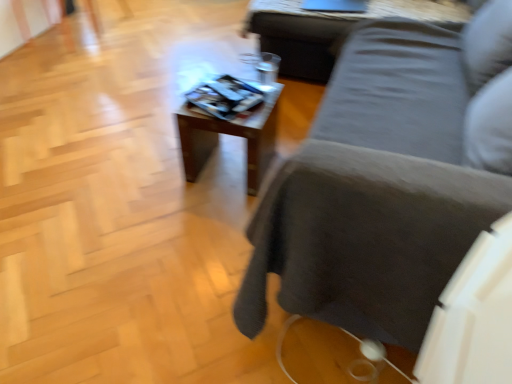
What are the coordinates of `wooden table at center, which ranks as the 1th table in left-to-right order` in the screenshot? It's located at (233, 135).

Who is taller, dark gray fabric couch at center or wooden table at upper center, which is the first table in right-to-left order?

Standing taller between the two is dark gray fabric couch at center.

Considering the relative positions of dark gray fabric couch at center and wooden table at upper center, the 2th table in the left-to-right sequence, in the image provided, is dark gray fabric couch at center to the right of wooden table at upper center, the 2th table in the left-to-right sequence, from the viewer's perspective?

Yes.

From a real-world perspective, count 1st tables downward from the dark gray fabric couch at center and point to it. Please provide its 2D coordinates.

[(330, 30)]

Which object is more forward, dark gray fabric couch at center or wooden table at upper center, which is the first table in right-to-left order?

dark gray fabric couch at center is more forward.

Is dark gray fabric couch at center oriented away from wooden table at center, placed as the first table when sorted from bottom to top?

No.

Looking at their sizes, would you say dark gray fabric couch at center is wider or thinner than wooden table at center, arranged as the first table when viewed from the front?

Clearly, dark gray fabric couch at center has more width compared to wooden table at center, arranged as the first table when viewed from the front.

Image resolution: width=512 pixels, height=384 pixels. Identify the location of the 1st table above the dark gray fabric couch at center (from the image's perspective). (233, 135).

Considering the positions of objects dark gray fabric couch at center and wooden table at center, arranged as the first table when viewed from the front, in the image provided, who is in front, dark gray fabric couch at center or wooden table at center, arranged as the first table when viewed from the front,?

Positioned in front is dark gray fabric couch at center.

Does wooden table at center, which ranks as the 1th table in left-to-right order, have a lesser height compared to wooden table at upper center, which is the 1th table from back to front?

In fact, wooden table at center, which ranks as the 1th table in left-to-right order, may be taller than wooden table at upper center, which is the 1th table from back to front.

Which is in front, point (197, 177) or point (318, 35)?

The point (197, 177) is closer.

Consider the image. Does wooden table at center, acting as the 2th table starting from the right, come behind wooden table at upper center, the second table from the bottom?

That is False.

Is wooden table at center, placed as the first table when sorted from bottom to top, aimed at wooden table at upper center, placed as the first table when sorted from top to bottom?

No, wooden table at center, placed as the first table when sorted from bottom to top, is not aimed at wooden table at upper center, placed as the first table when sorted from top to bottom.

Is wooden table at center, which is the 2th table in top-to-bottom order, oriented towards dark gray fabric couch at center?

No.

Looking at this image, which is closer to the camera, (x=270, y=154) or (x=377, y=311)?

The point (x=377, y=311) is in front.

From their relative heights in the image, would you say wooden table at center, acting as the 2th table starting from the right, is taller or shorter than dark gray fabric couch at center?

Clearly, wooden table at center, acting as the 2th table starting from the right, is shorter compared to dark gray fabric couch at center.

Looking at this image, from the image's perspective, is wooden table at center, acting as the 2th table starting from the right, under dark gray fabric couch at center?

Incorrect, from the image's perspective, wooden table at center, acting as the 2th table starting from the right, is higher than dark gray fabric couch at center.

Is wooden table at upper center, the second table from the bottom, outside of wooden table at center, which ranks as the 1th table in left-to-right order?

Absolutely, wooden table at upper center, the second table from the bottom, is external to wooden table at center, which ranks as the 1th table in left-to-right order.

From a real-world perspective, relative to wooden table at center, which is the 2th table in back-to-front order, is wooden table at upper center, marked as the 2th table in a front-to-back arrangement, vertically above or below?

Clearly, from a real-world perspective, wooden table at upper center, marked as the 2th table in a front-to-back arrangement, is above wooden table at center, which is the 2th table in back-to-front order.

Can you tell me how much wooden table at upper center, placed as the first table when sorted from top to bottom, and wooden table at center, arranged as the first table when viewed from the front, differ in facing direction?

The facing directions of wooden table at upper center, placed as the first table when sorted from top to bottom, and wooden table at center, arranged as the first table when viewed from the front, are 89.8 degrees apart.

Are wooden table at upper center, marked as the 2th table in a front-to-back arrangement, and wooden table at center, placed as the first table when sorted from bottom to top, located far from each other?

Actually, wooden table at upper center, marked as the 2th table in a front-to-back arrangement, and wooden table at center, placed as the first table when sorted from bottom to top, are a little close together.

Is wooden table at upper center, which is the first table in right-to-left order, shorter than dark gray fabric couch at center?

Yes.

Which is less distant, (296, 5) or (416, 75)?

The point (416, 75) is more forward.

Are wooden table at upper center, which is the 1th table from back to front, and dark gray fabric couch at center far apart?

That's not correct — wooden table at upper center, which is the 1th table from back to front, is a little close to dark gray fabric couch at center.

From a real-world perspective, which table is the 1st one underneath the dark gray fabric couch at center? Please provide its 2D coordinates.

[(330, 30)]

Find the location of a particular element. The image size is (512, 384). studio couch that appears above the wooden table at center, which is the 2th table in top-to-bottom order (from a real-world perspective) is located at coordinates (388, 180).

From the image, which object appears to be farther from wooden table at upper center, the second table from the bottom, wooden table at center, acting as the 2th table starting from the right, or dark gray fabric couch at center?

Among the two, dark gray fabric couch at center is located further to wooden table at upper center, the second table from the bottom.

Which object lies nearer to the anchor point wooden table at center, which is the 2th table in top-to-bottom order, dark gray fabric couch at center or wooden table at upper center, the 2th table in the left-to-right sequence?

dark gray fabric couch at center is positioned closer to the anchor wooden table at center, which is the 2th table in top-to-bottom order.

Estimate the real-world distances between objects in this image. Which object is closer to dark gray fabric couch at center, wooden table at upper center, the second table from the bottom, or wooden table at center, arranged as the first table when viewed from the front?

wooden table at center, arranged as the first table when viewed from the front, is closer to dark gray fabric couch at center.

Estimate the real-world distances between objects in this image. Which object is closer to wooden table at center, placed as the first table when sorted from bottom to top, wooden table at upper center, which is the 1th table from back to front, or dark gray fabric couch at center?

dark gray fabric couch at center is closer to wooden table at center, placed as the first table when sorted from bottom to top.

Looking at the image, which one is located closer to wooden table at upper center, which is the first table in right-to-left order, dark gray fabric couch at center or wooden table at center, acting as the 2th table starting from the right?

wooden table at center, acting as the 2th table starting from the right, lies closer to wooden table at upper center, which is the first table in right-to-left order, than the other object.

When comparing their distances from dark gray fabric couch at center, does wooden table at center, which is the 2th table in back-to-front order, or wooden table at upper center, the 2th table in the left-to-right sequence, seem closer?

wooden table at center, which is the 2th table in back-to-front order, is closer to dark gray fabric couch at center.

Where is `table between dark gray fabric couch at center and wooden table at upper center, which is the 1th table from back to front, in the front-back direction`? table between dark gray fabric couch at center and wooden table at upper center, which is the 1th table from back to front, in the front-back direction is located at coordinates (233, 135).